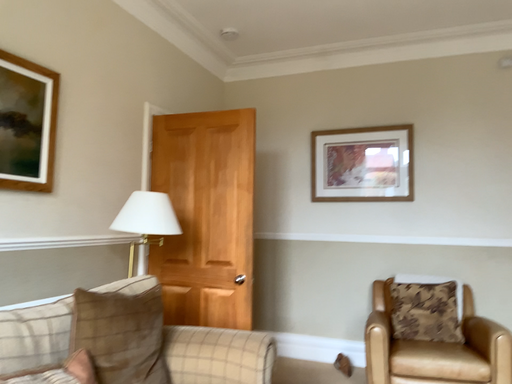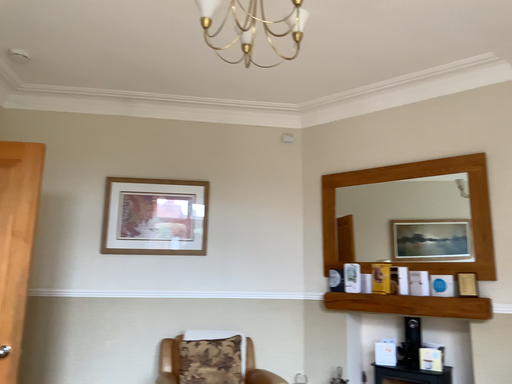
Question: Which way did the camera rotate in the video?

Choices:
 (A) rotated left
 (B) rotated right

Answer: (B)